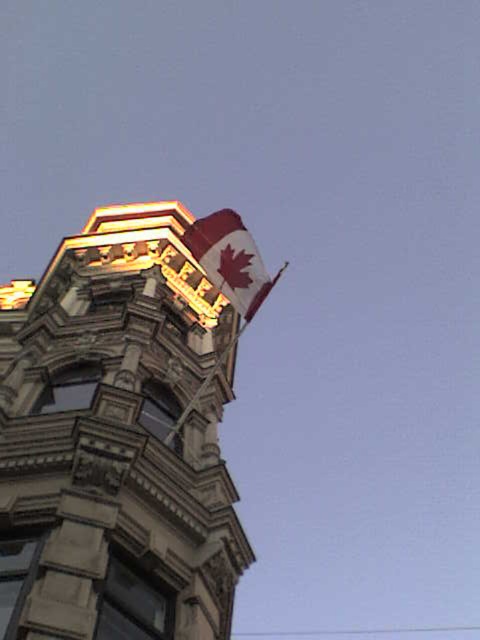
You are an architect analyzing the building facade. From your perspective, which object between the polished stone tower at upper center and the red and white fabric flag at upper center has a greater width?

The polished stone tower at upper center has a greater width than the red and white fabric flag at upper center.

You are standing in front of the building and see the point marked at coordinates (229, 259). What object is located at that point?

The point at (229, 259) corresponds to the red and white fabric flag at upper center.

You are standing in front of the building and want to place two markers on the ground at the locations corresponding to the points point (210, 220) and point (204, 390). Which marker will be closer to the building?

Point (210, 220) is behind point (204, 390), so the marker at point (204, 390) will be closer to the building.